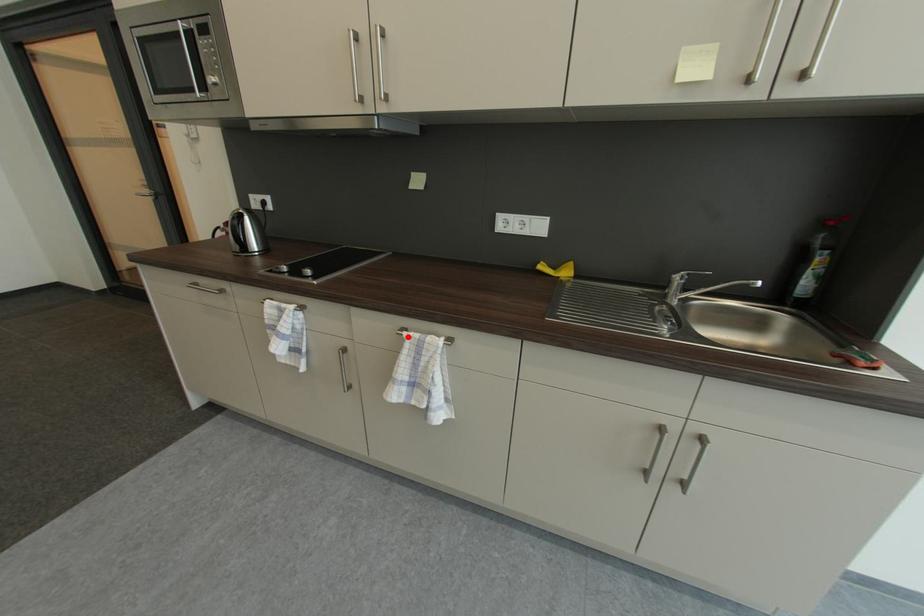
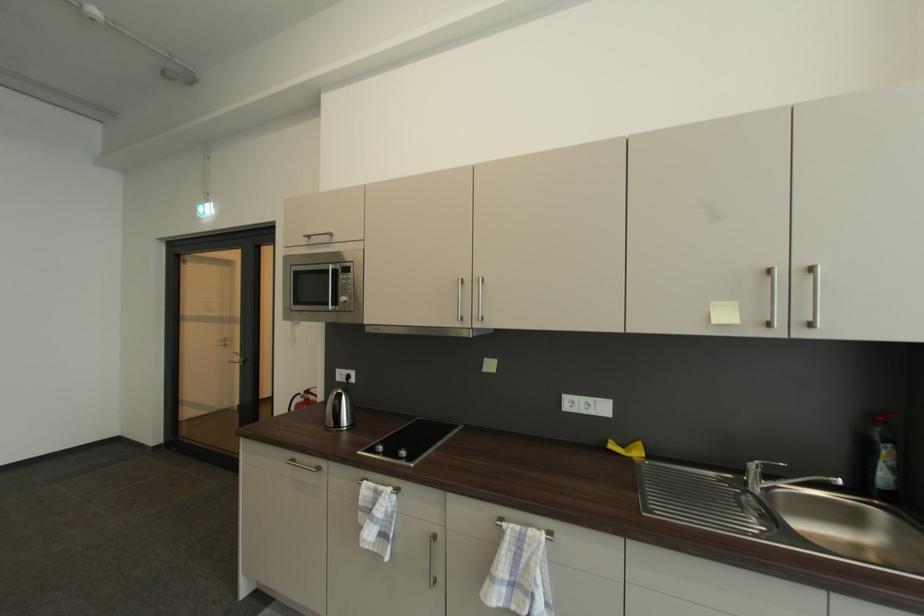
Locate, in the second image, the point that corresponds to the highlighted location in the first image.

(507, 529)